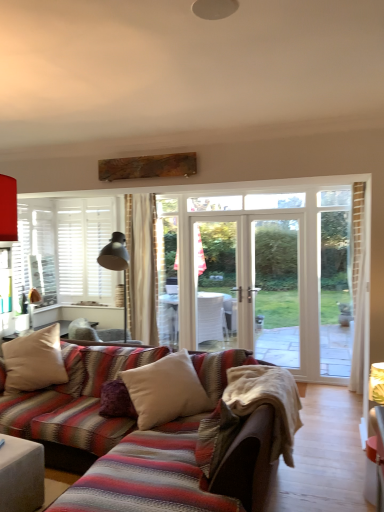
Question: From the image's perspective, relative to white soft cushion at center, which ranks as the first pillow in right-to-left order, is matte gray ottoman at lower left above or below?

Choices:
 (A) below
 (B) above

Answer: (A)

Question: Is matte gray ottoman at lower left inside or outside of white soft cushion at center, the third pillow from the left?

Choices:
 (A) outside
 (B) inside

Answer: (A)

Question: Which of these objects is positioned closest to the white soft cushion at center, which ranks as the first pillow in right-to-left order?

Choices:
 (A) beige cotton blanket at lower center
 (B) beige fabric pillow at lower left, the third pillow from the right
 (C) matte gray ottoman at lower left
 (D) velvet purple pillow at center, positioned as the second pillow in right-to-left order

Answer: (D)

Question: Based on their relative distances, which object is nearer to the matte gray ottoman at lower left?

Choices:
 (A) velvet purple pillow at center, positioned as the second pillow in right-to-left order
 (B) beige cotton blanket at lower center
 (C) beige fabric pillow at lower left, which appears as the 1th pillow when viewed from the left
 (D) white soft cushion at center, which ranks as the first pillow in right-to-left order

Answer: (A)